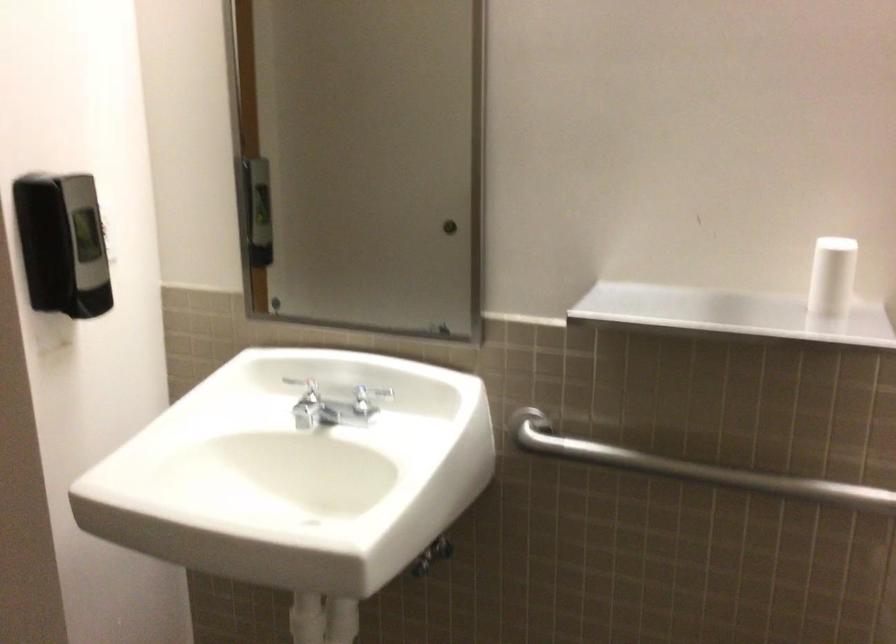
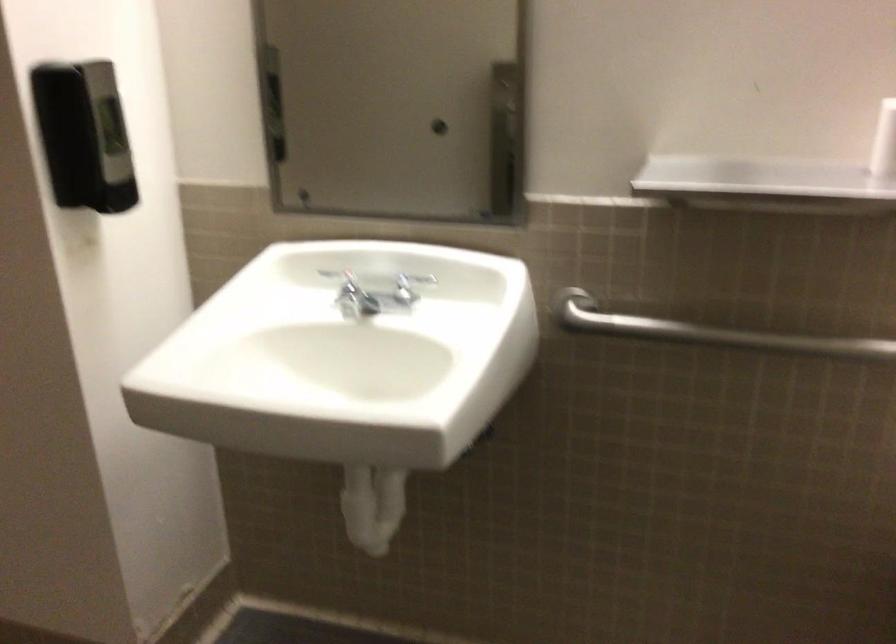
Locate, in the second image, the point that corresponds to pixel 655 460 in the first image.

(707, 332)